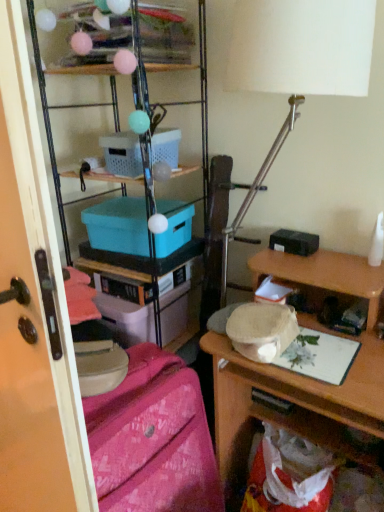
Question: From the image's perspective, is pink fabric suitcase at lower left above or below matte plastic storage at upper left, the 1th shelf positioned from the bottom?

Choices:
 (A) below
 (B) above

Answer: (A)

Question: Relative to matte plastic storage at upper left, the 2th shelf viewed from the top, is pink fabric suitcase at lower left in front or behind?

Choices:
 (A) behind
 (B) front

Answer: (B)

Question: Based on their relative distances, which object is nearer to the teal plastic box at center, which is counted as the 2th box, starting from the top?

Choices:
 (A) wooden desk at right
 (B) matte plastic storage at upper left, the 1th shelf positioned from the bottom
 (C) translucent plastic shelf at upper center, which ranks as the first shelf in top-to-bottom order
 (D) white matte table lamp at upper center
 (E) transparent plastic screen door at left

Answer: (B)

Question: Which object is positioned farthest from the pink fabric suitcase at lower left?

Choices:
 (A) white matte table lamp at upper center
 (B) teal plastic box at center, which is counted as the 2th box, starting from the top
 (C) matte plastic storage at upper left, the 1th shelf positioned from the bottom
 (D) transparent plastic screen door at left
 (E) wooden desk at right

Answer: (C)